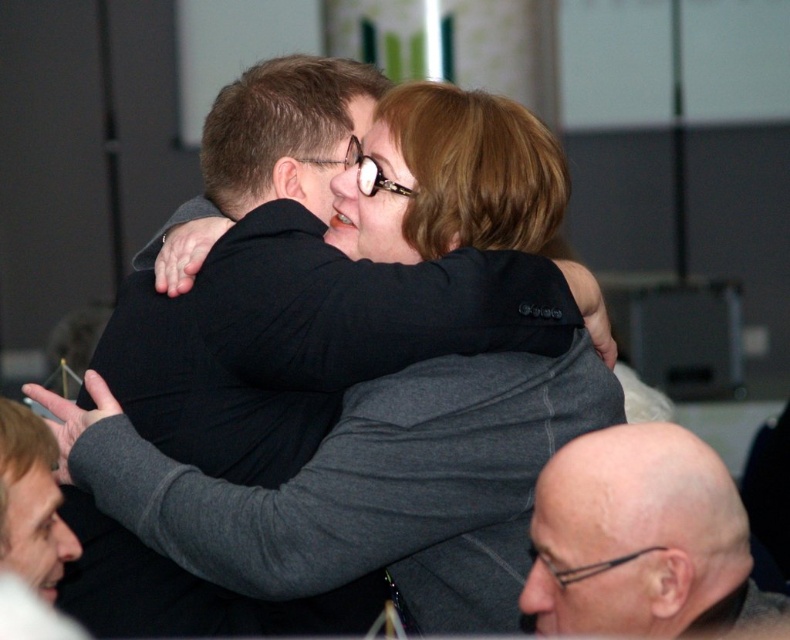
Which is behind, point (708, 625) or point (21, 538)?

Point (708, 625)

Measure the distance between bald head at lower right and gray fabric jacket at center.

bald head at lower right is 37.26 inches from gray fabric jacket at center.

Does point (567, 529) come farther from viewer compared to point (29, 442)?

Yes, it is behind point (29, 442).

Identify the location of bald head at lower right. The height and width of the screenshot is (640, 790). 640,540.

How much distance is there between dark gray sweater at center and gray fabric jacket at center?

A distance of 21.53 inches exists between dark gray sweater at center and gray fabric jacket at center.

Between dark gray sweater at center and gray fabric jacket at center, which one is positioned lower?

Positioned lower is gray fabric jacket at center.

Between point (345, 467) and point (36, 556), which one is positioned in front?

Positioned in front is point (36, 556).

In order to click on dark gray sweater at center in this screenshot , I will do `click(345, 368)`.

Based on the photo, can you confirm if dark gray sweater at center is bigger than bald head at lower right?

Yes, dark gray sweater at center is bigger than bald head at lower right.

Who is shorter, dark gray sweater at center or bald head at lower right?

With less height is bald head at lower right.

Which is in front, point (333, 396) or point (550, 474)?

Point (550, 474) is more forward.

The image size is (790, 640). Find the location of `dark gray sweater at center`. dark gray sweater at center is located at coordinates (345, 368).